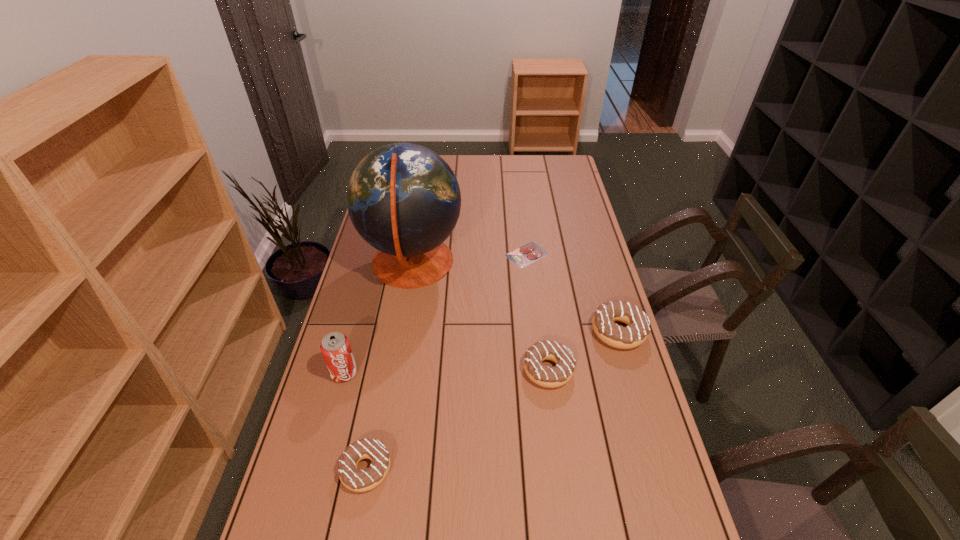
The height and width of the screenshot is (540, 960). Identify the location of free space at the left edge. (324, 489).

Find the location of a particular element. Image resolution: width=960 pixels, height=540 pixels. vacant space at the right edge of the desktop is located at coordinates (609, 450).

Locate an element on the screen. This screenshot has height=540, width=960. free space at the far right corner of the desktop is located at coordinates (544, 178).

What are the coordinates of `free spot between the globe and the rightmost object` in the screenshot? It's located at (516, 298).

This screenshot has width=960, height=540. Find the location of `vacant area that lies between the fifth tallest object and the second doughnut from left to right`. vacant area that lies between the fifth tallest object and the second doughnut from left to right is located at coordinates (457, 420).

Where is `vacant area between the rightmost object and the second tallest doughnut`? vacant area between the rightmost object and the second tallest doughnut is located at coordinates (584, 350).

Image resolution: width=960 pixels, height=540 pixels. Find the location of `free space between the second doughnut from right to left and the rightmost doughnut`. free space between the second doughnut from right to left and the rightmost doughnut is located at coordinates (584, 350).

Locate an element on the screen. The width and height of the screenshot is (960, 540). free space between the nearest doughnut and the salami is located at coordinates (446, 362).

Where is `vacant space that is in between the tallest object and the second doughnut from left to right`? vacant space that is in between the tallest object and the second doughnut from left to right is located at coordinates (480, 316).

Find the location of a particular element. Image resolution: width=960 pixels, height=540 pixels. vacant space that is in between the leftmost doughnut and the salami is located at coordinates (446, 362).